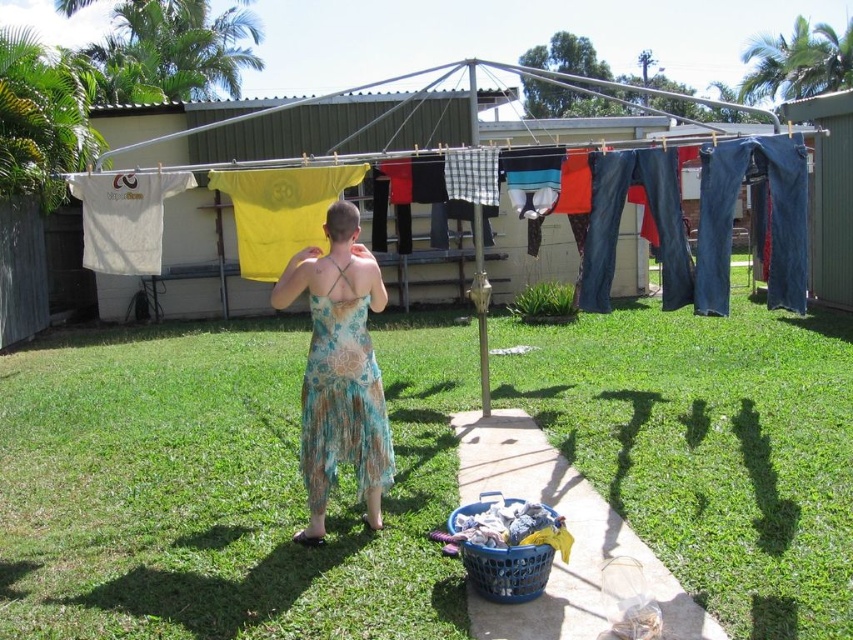
Question: Can you confirm if green grass at lower left is positioned to the left of blue plastic basket at lower center?

Choices:
 (A) no
 (B) yes

Answer: (A)

Question: Which object appears farthest from the camera in this image?

Choices:
 (A) green grass at lower left
 (B) blue plastic basket at lower center

Answer: (B)

Question: Which point appears closest to the camera in this image?

Choices:
 (A) (473, 547)
 (B) (415, 163)

Answer: (A)

Question: Among these objects, which one is nearest to the camera?

Choices:
 (A) blue plastic laundry basket at lower center
 (B) green grass at lower left

Answer: (B)

Question: Can you confirm if green grass at lower left is wider than floral fabric dress at center?

Choices:
 (A) yes
 (B) no

Answer: (A)

Question: Does denim jeans at upper center come in front of blue plastic basket at lower center?

Choices:
 (A) yes
 (B) no

Answer: (B)